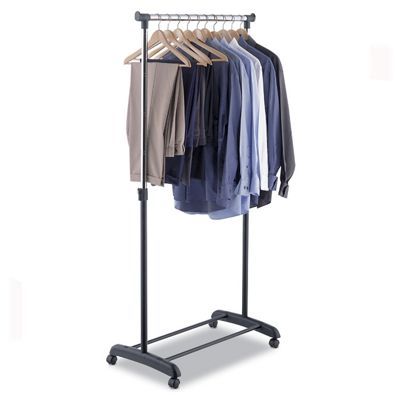
I want to click on hanger, so click(156, 38), click(167, 35), click(178, 35), click(190, 35), click(198, 34), click(204, 32), click(214, 34), click(226, 37), click(234, 34), click(244, 31).